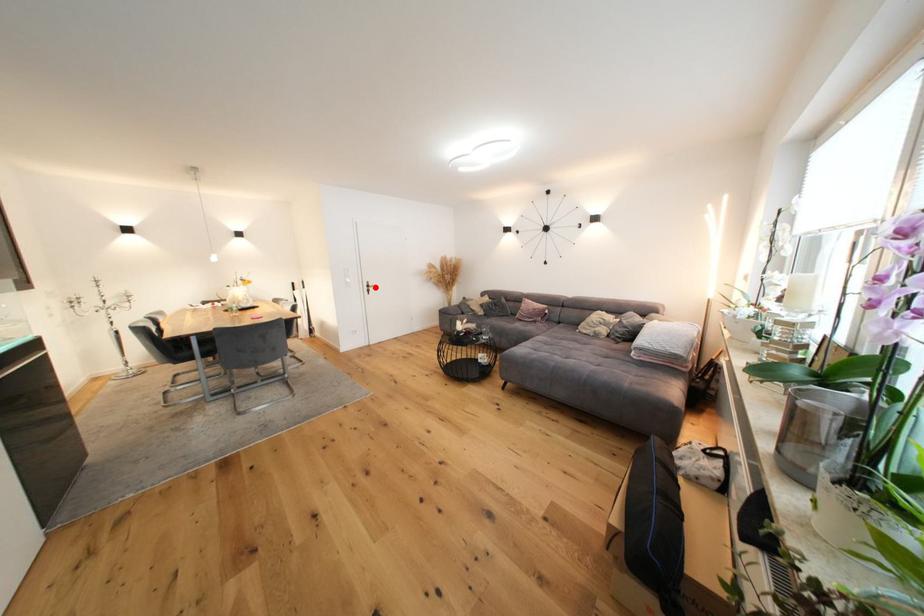
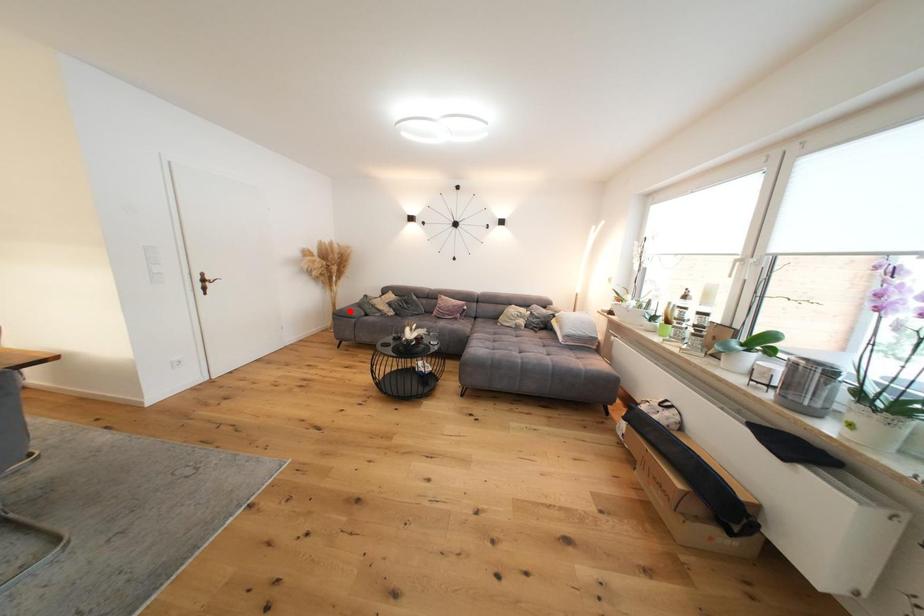
I am providing you with two images of the same scene from different viewpoints. A red point is marked on the first image and another point is marked on the second image. Is the red point in image1 aligned with the point shown in image2?

No